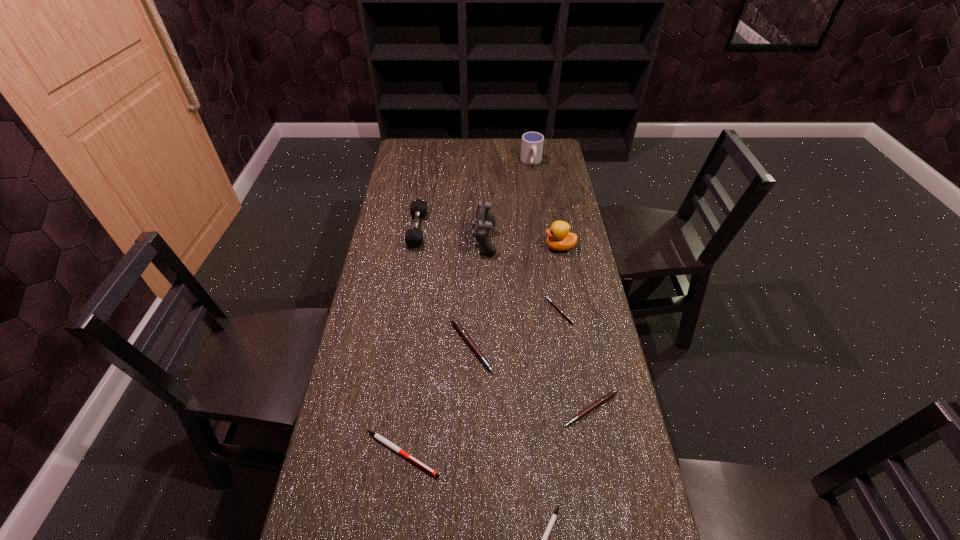
Locate an element on the screen. Image resolution: width=960 pixels, height=540 pixels. object that is at the far right corner is located at coordinates (532, 142).

Find the location of a particular element. vacant space at the far edge of the desktop is located at coordinates (501, 142).

The width and height of the screenshot is (960, 540). In the image, there is a desktop. In order to click on vacant space at the left edge in this screenshot , I will do `click(380, 415)`.

Locate an element on the screen. This screenshot has height=540, width=960. vacant space at the right edge of the desktop is located at coordinates (580, 289).

The image size is (960, 540). I want to click on free location at the far right corner, so click(563, 164).

What are the coordinates of `free space between the control and the yellow duckling` in the screenshot? It's located at (522, 243).

Identify the location of free space between the smallest pink pen and the nearest pink pen. This screenshot has height=540, width=960. (575, 360).

Identify the location of empty space that is in between the third nearest object and the smallest pink pen. (575, 360).

This screenshot has height=540, width=960. In order to click on free space that is in between the biggest pink pen and the second nearest object in this screenshot , I will do `click(436, 400)`.

Locate an element on the screen. This screenshot has height=540, width=960. empty space that is in between the dumbbell and the smallest pink pen is located at coordinates (489, 270).